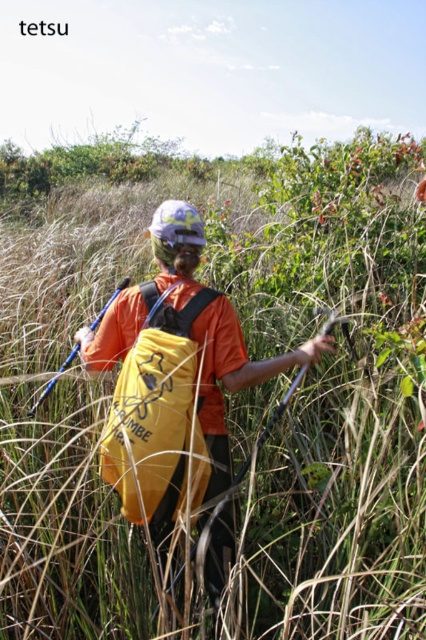
Question: Can you confirm if yellow matte backpack at center is wider than yellow fabric backpack at center?

Choices:
 (A) no
 (B) yes

Answer: (B)

Question: Is yellow matte backpack at center to the right of yellow fabric backpack at center from the viewer's perspective?

Choices:
 (A) yes
 (B) no

Answer: (A)

Question: Which of the following is the closest to the observer?

Choices:
 (A) (178, 332)
 (B) (74, 337)

Answer: (A)

Question: Can you confirm if yellow matte backpack at center is bigger than yellow fabric backpack at center?

Choices:
 (A) no
 (B) yes

Answer: (B)